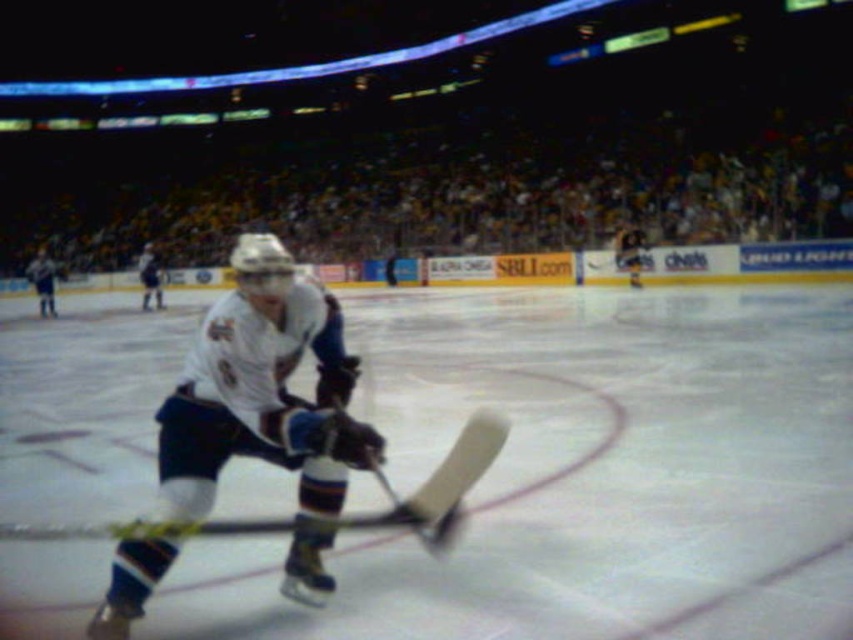
You are a spectator sitting in the front row of the arena. You see the white matte hockey stick at center and the white jersey at left. Which object is nearer to you?

The white matte hockey stick at center is closer to the viewer than the white jersey at left, so the hockey stick is nearer to you.

You are a spectator sitting in the arena and want to take a photo of the player. You notice the white matte hockey stick at center and the white jersey at left. Which object should you focus on first if you want to capture both in the same frame?

The white jersey at left is to the left of the white matte hockey stick at center, so you should focus on the white jersey at left first to ensure both are in the frame.

You are an ice hockey player wearing a white jersey with blue accents. You are currently holding your hockey stick and see the point marked at coordinates [262,388]. Is your hockey stick located at that point?

Yes, the white matte hockey stick at center is located at point [262,388].